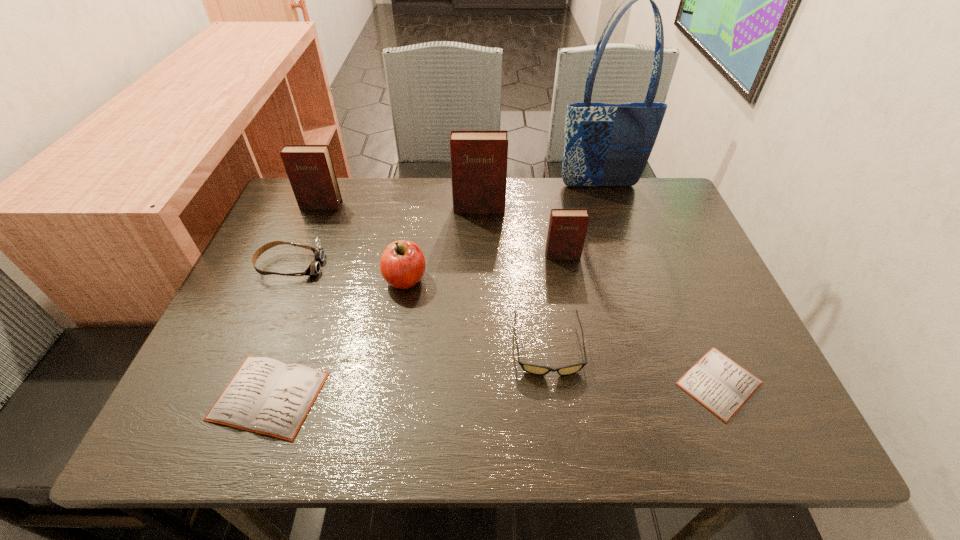
Where is `the sixth tallest object`? the sixth tallest object is located at coordinates (314, 268).

Image resolution: width=960 pixels, height=540 pixels. What are the coordinates of `brown goggles` in the screenshot? It's located at (314, 268).

I want to click on sunglasses, so point(534,369).

Identify the location of the second shortest object. point(266,396).

Identify the location of the left white diary. coord(266,396).

This screenshot has width=960, height=540. Identify the location of the rightmost diary. (721, 385).

At what (x,y) coordinates should I click in order to perform the action: click on the shortest diary. Please return your answer as a coordinate pair (x, y). The height and width of the screenshot is (540, 960). Looking at the image, I should click on (721, 385).

At what (x,y) coordinates should I click in order to perform the action: click on free space located on the front-facing side of the shopping bag. Please return your answer as a coordinate pair (x, y). Looking at the image, I should click on (613, 228).

Where is `blank area located 0.210m on the front cover of the tallest diary`? Image resolution: width=960 pixels, height=540 pixels. blank area located 0.210m on the front cover of the tallest diary is located at coordinates (479, 266).

The image size is (960, 540). Find the location of `vacant area situated 0.300m on the front cover of the third tallest object`. vacant area situated 0.300m on the front cover of the third tallest object is located at coordinates (287, 288).